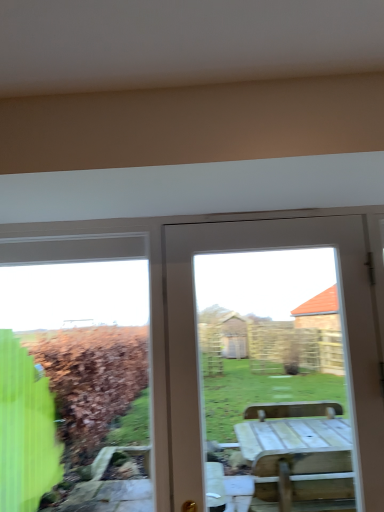
Question: Are green glass window at left and white wood door at center making contact?

Choices:
 (A) no
 (B) yes

Answer: (A)

Question: Is the position of green glass window at left less distant than that of white wood door at center?

Choices:
 (A) no
 (B) yes

Answer: (A)

Question: Is green glass window at left surrounding white wood door at center?

Choices:
 (A) yes
 (B) no

Answer: (B)

Question: Is green glass window at left bigger than white wood door at center?

Choices:
 (A) no
 (B) yes

Answer: (A)

Question: Is green glass window at left far away from white wood door at center?

Choices:
 (A) yes
 (B) no

Answer: (A)

Question: Is green glass window at left located outside white wood door at center?

Choices:
 (A) yes
 (B) no

Answer: (A)

Question: Is white wood door at center oriented away from green glass window at left?

Choices:
 (A) no
 (B) yes

Answer: (A)

Question: From a real-world perspective, is white wood door at center positioned under green glass window at left based on gravity?

Choices:
 (A) yes
 (B) no

Answer: (B)

Question: Does white wood door at center have a greater width compared to green glass window at left?

Choices:
 (A) yes
 (B) no

Answer: (A)

Question: From the image's perspective, is white wood door at center located beneath green glass window at left?

Choices:
 (A) yes
 (B) no

Answer: (B)

Question: Is white wood door at center positioned behind green glass window at left?

Choices:
 (A) yes
 (B) no

Answer: (B)

Question: Can you confirm if white wood door at center is smaller than green glass window at left?

Choices:
 (A) yes
 (B) no

Answer: (B)

Question: Looking at the image, does white wood door at center seem bigger or smaller compared to green glass window at left?

Choices:
 (A) small
 (B) big

Answer: (B)